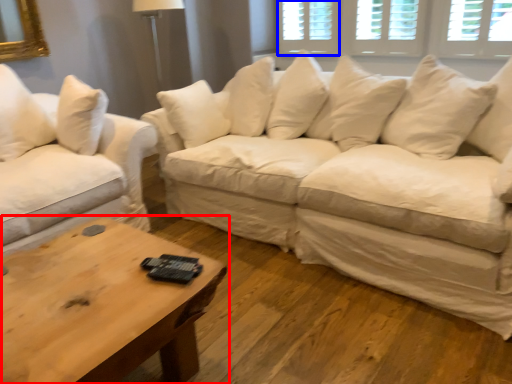
Question: Among these objects, which one is farthest to the camera, coffee table (highlighted by a red box) or window (highlighted by a blue box)?

Choices:
 (A) coffee table
 (B) window

Answer: (B)